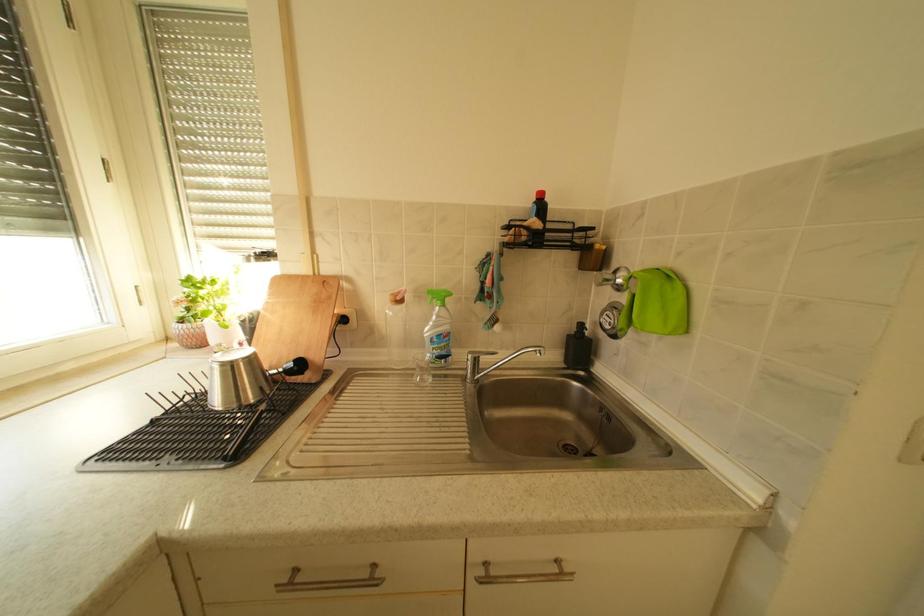
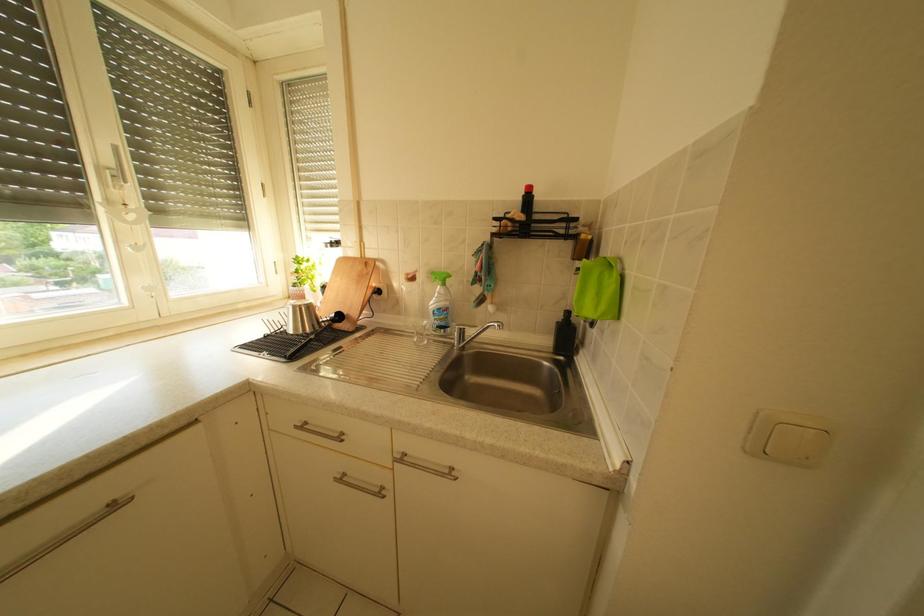
Question: Based on the continuous images, in which direction is the camera rotating? Reply with the corresponding letter.

Choices:
 (A) Left
 (B) Right
 (C) Up
 (D) Down

Answer: (A)